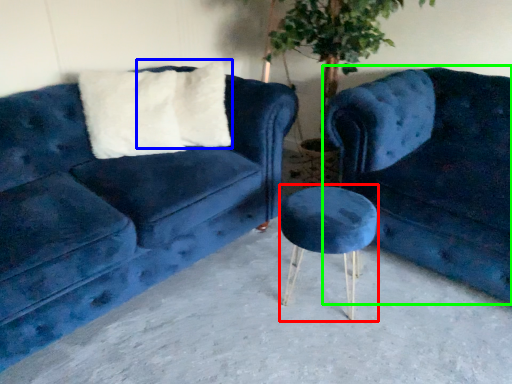
Question: Based on their relative distances, which object is nearer to bar stool (highlighted by a red box)? Choose from pillow (highlighted by a blue box) and studio couch (highlighted by a green box).

Choices:
 (A) pillow
 (B) studio couch

Answer: (B)